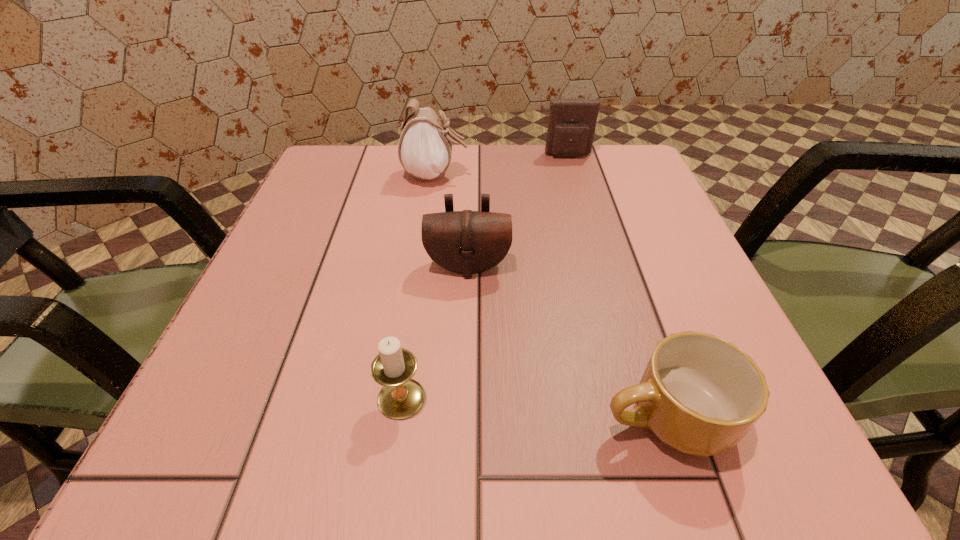
Where is `unoccupied position between the nearest pouch and the candle holder`? This screenshot has width=960, height=540. unoccupied position between the nearest pouch and the candle holder is located at coordinates (435, 332).

In order to click on vacant area between the mug and the tallest pouch in this screenshot , I will do `click(550, 296)`.

I want to click on vacant area that lies between the candle holder and the third nearest object, so click(x=435, y=332).

At what (x,y) coordinates should I click in order to perform the action: click on vacant area between the farthest object and the tallest pouch. Please return your answer as a coordinate pair (x, y). This screenshot has width=960, height=540. Looking at the image, I should click on coord(502,165).

You are a GUI agent. You are given a task and a screenshot of the screen. Output one action in this format:
    pyautogui.click(x=<x>, y=<y>)
    Task: Click on the third closest object to the second farthest object
    
    Given the screenshot: What is the action you would take?
    pyautogui.click(x=400, y=397)

Locate an element on the screen. This screenshot has width=960, height=540. the second closest object relative to the tallest object is located at coordinates (467, 242).

Identify which pouch is located as the nearest to the rightmost pouch. Please provide its 2D coordinates. Your answer should be formatted as a tuple, i.e. [(x, y)], where the tuple contains the x and y coordinates of a point satisfying the conditions above.

[(425, 147)]

Locate an element on the screen. The image size is (960, 540). pouch that stands as the closest to the shortest object is located at coordinates (467, 242).

Where is `blank area in the image that satisfies the following two spatial constraints: 1. with an open flap on the farthest pouch; 2. on the front-facing side of the tallest pouch`? The height and width of the screenshot is (540, 960). blank area in the image that satisfies the following two spatial constraints: 1. with an open flap on the farthest pouch; 2. on the front-facing side of the tallest pouch is located at coordinates (574, 175).

The width and height of the screenshot is (960, 540). In order to click on vacant position in the image that satisfies the following two spatial constraints: 1. on the side with the handle of the shortest object; 2. with the flap open on the nearest pouch in this screenshot , I will do `click(616, 266)`.